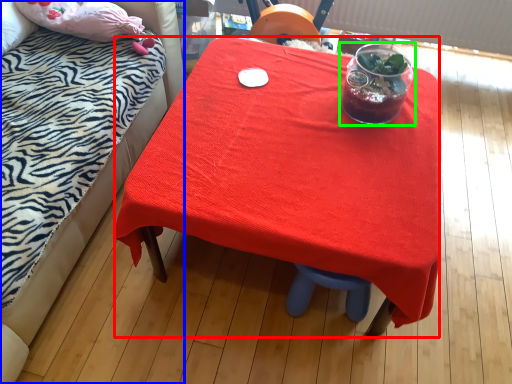
Question: Considering the real-world distances, which object is farthest from desk (highlighted by a red box)? bed (highlighted by a blue box) or tableware (highlighted by a green box)?

Choices:
 (A) bed
 (B) tableware

Answer: (A)